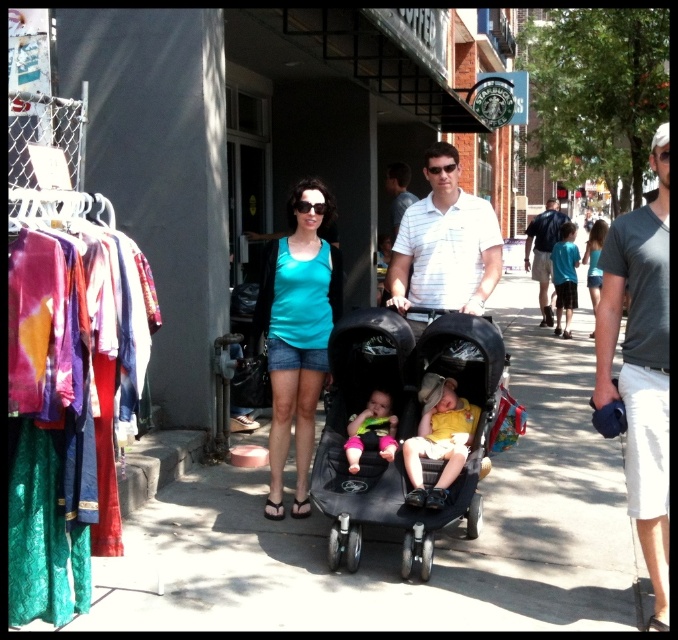
You are a delivery person who needs to place a package on the sidewalk. The package must be placed exactly at the point with coordinates (399, 428). However, there is an object at that location. What object is located at that point?

The point at coordinates (399, 428) is occupied by the black matte stroller at center.

You are a delivery person trying to place a package on the smooth concrete pavement at center. However, there is a soft pink fabric baby at center in the way. Can you move the baby to the side to make space?

The smooth concrete pavement at center is positioned under the soft pink fabric baby at center, meaning the baby is already on the pavement. To place the package, you would need to carefully move the soft pink fabric baby at center aside to create space.